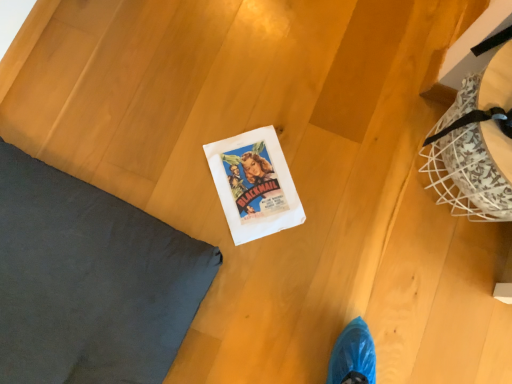
You are a GUI agent. You are given a task and a screenshot of the screen. Output one action in this format:
    pyautogui.click(x=<x>, y=<y>)
    Task: Click on the vacant area located to the right-hand side of white paper comic book at center
    The height and width of the screenshot is (384, 512).
    Given the screenshot: What is the action you would take?
    pyautogui.click(x=315, y=185)